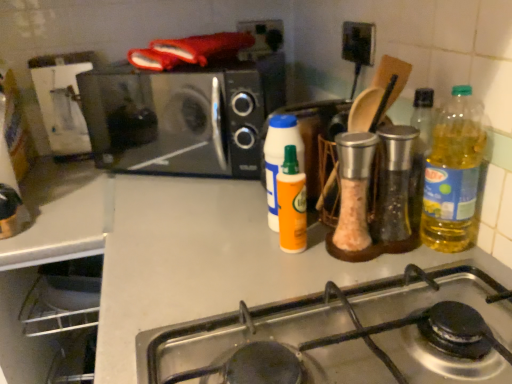
Locate an element on the screen. The image size is (512, 384). vacant space behind orange matte spray can at center, acting as the second bottle starting from the left is located at coordinates (242, 206).